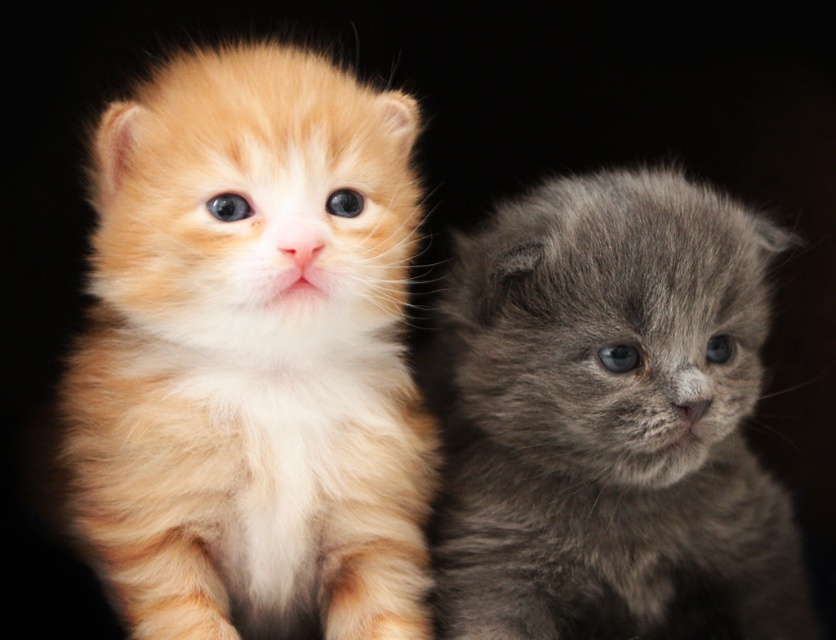
Question: Is fluffy orange kitten at center above gray fluffy kitten at right?

Choices:
 (A) no
 (B) yes

Answer: (B)

Question: Is fluffy orange kitten at center bigger than gray fluffy kitten at right?

Choices:
 (A) no
 (B) yes

Answer: (B)

Question: Which of the following is the farthest from the observer?

Choices:
 (A) fluffy orange kitten at center
 (B) gray fluffy kitten at right

Answer: (B)

Question: Which point is farther to the camera?

Choices:
 (A) (x=444, y=337)
 (B) (x=130, y=298)

Answer: (A)

Question: Can you confirm if fluffy orange kitten at center is positioned to the right of gray fluffy kitten at right?

Choices:
 (A) yes
 (B) no

Answer: (B)